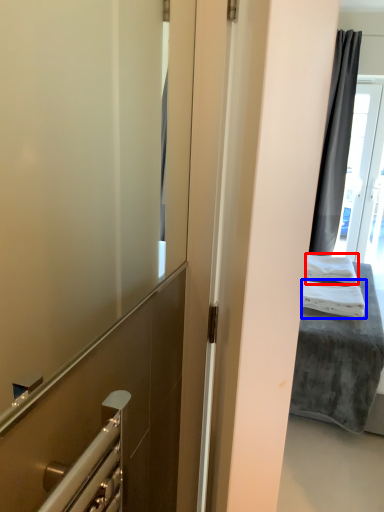
Question: Which point is further to the camera, bath towel (highlighted by a red box) or bath towel (highlighted by a blue box)?

Choices:
 (A) bath towel
 (B) bath towel

Answer: (A)